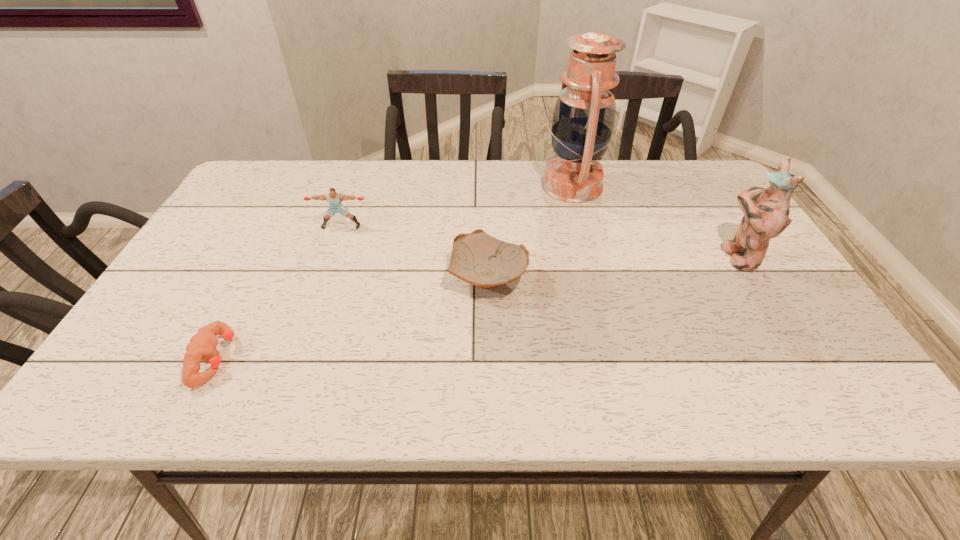
Find the location of a particular element. This screenshot has height=540, width=960. free space located on the left of the tallest object is located at coordinates (489, 185).

Find the location of a particular element. This screenshot has height=540, width=960. vacant area located 0.160m on the front-facing side of the rightmost object is located at coordinates [659, 255].

Where is `vacant space located on the front-facing side of the rightmost object`? vacant space located on the front-facing side of the rightmost object is located at coordinates (638, 255).

At what (x,y) coordinates should I click in order to perform the action: click on vacant space located 0.190m on the front-facing side of the rightmost object. Please return your answer as a coordinate pair (x, y). This screenshot has width=960, height=540. Looking at the image, I should click on (646, 255).

Find the location of a particular element. The height and width of the screenshot is (540, 960). free space located 0.320m on the front-facing side of the farther puncher is located at coordinates (307, 322).

Identify the location of free spot located on the front of the third object from right to left. The width and height of the screenshot is (960, 540). (491, 404).

Identify the location of vacant space located 0.110m with the gloves of the nearer puncher facing forward. (287, 358).

The width and height of the screenshot is (960, 540). What are the coordinates of `object that is at the far edge` in the screenshot? It's located at (583, 120).

The image size is (960, 540). I want to click on object positioned at the near edge, so click(202, 346).

Where is `object that is positioned at the left edge`? The height and width of the screenshot is (540, 960). object that is positioned at the left edge is located at coordinates (202, 346).